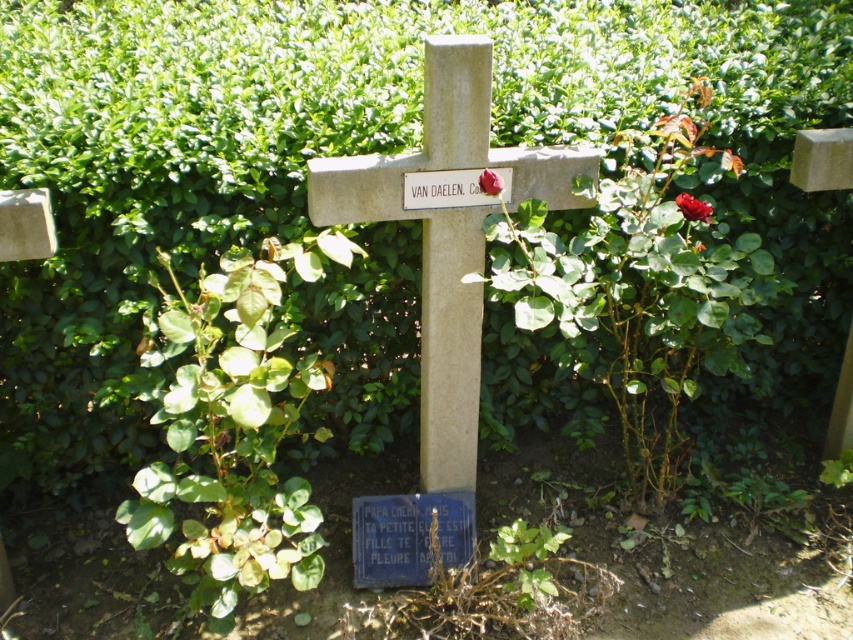
Question: Which point is closer to the camera taking this photo?

Choices:
 (A) (379, 172)
 (B) (675, 198)
 (C) (450, 492)
 (D) (495, 180)

Answer: (D)

Question: Does glossy red rose at upper right lie behind red velvet rose at center?

Choices:
 (A) no
 (B) yes

Answer: (B)

Question: Which point appears closest to the camera in this image?

Choices:
 (A) (416, 572)
 (B) (479, 177)

Answer: (B)

Question: Is blue polished stone plaque at center below glossy red rose at upper right?

Choices:
 (A) no
 (B) yes

Answer: (B)

Question: Does smooth stone cross at center have a smaller size compared to glossy red rose at upper right?

Choices:
 (A) no
 (B) yes

Answer: (A)

Question: Which object is farther from the camera taking this photo?

Choices:
 (A) glossy red rose at upper right
 (B) smooth stone cross at center
 (C) red velvet rose at center
 (D) blue polished stone plaque at center

Answer: (D)